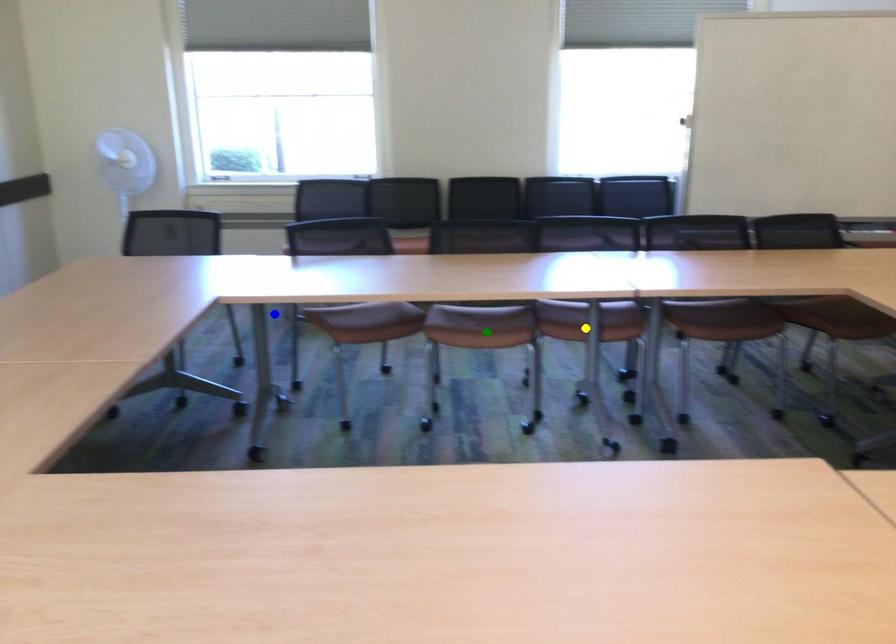
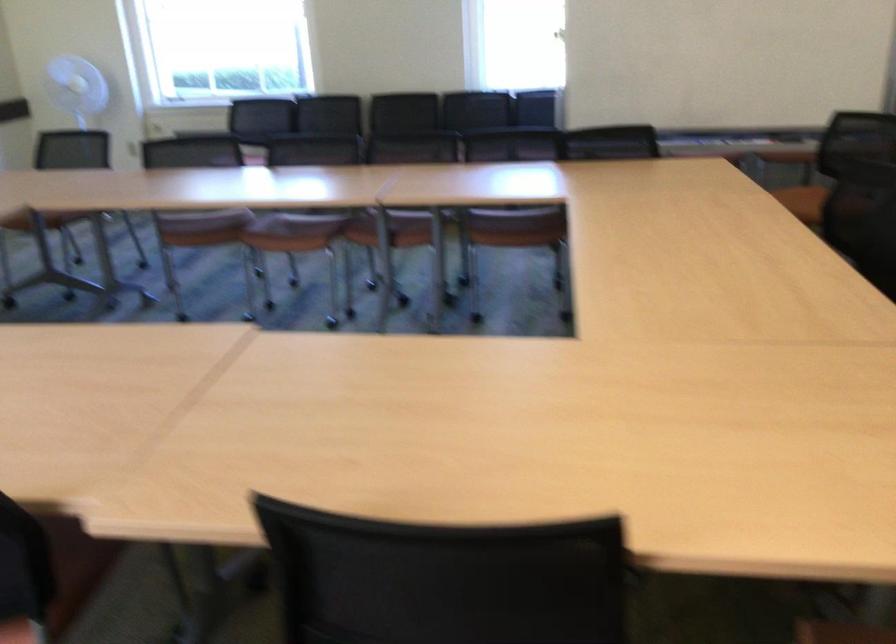
I am providing you with two images of the same scene from different viewpoints. Three points are marked in image1. Which point corresponds to a part or object that is occluded in image2?In image1, three points are marked. Which of them correspond to a part or object that is occluded in image2?Among the three points shown in image1, which one corresponds to a part or object that is no longer visible due to occlusion in image2?

blue point